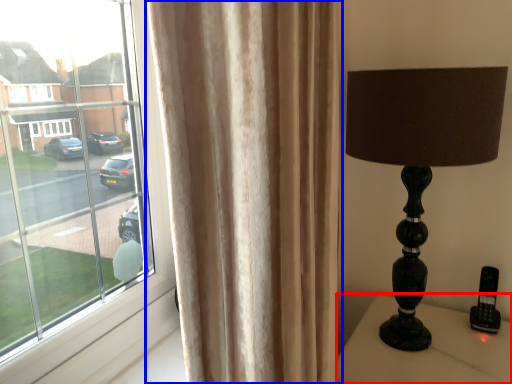
Question: Which object appears farthest to the camera in this image, furniture (highlighted by a red box) or curtain (highlighted by a blue box)?

Choices:
 (A) furniture
 (B) curtain

Answer: (A)